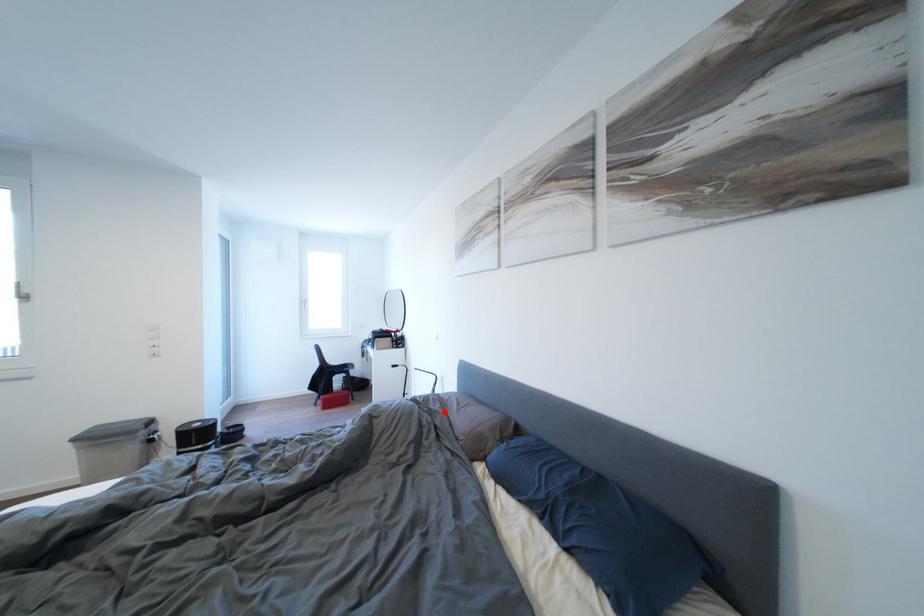
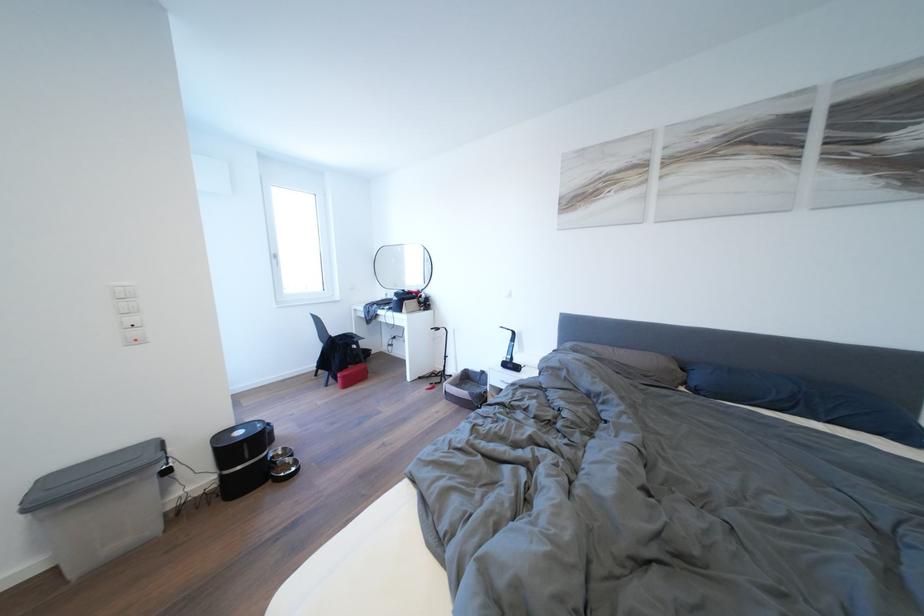
Find the pixel in the second image that matches the highlighted location in the first image.

(602, 360)